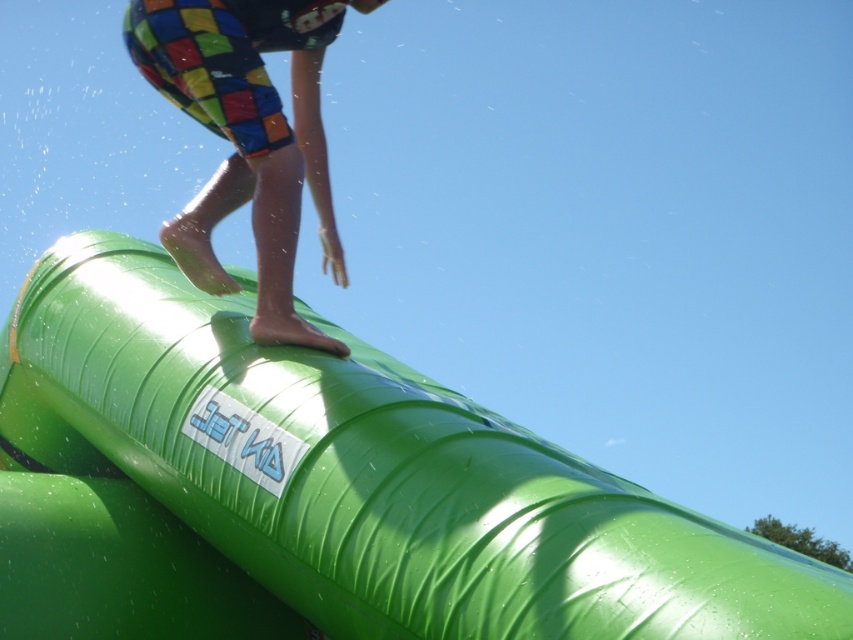
Question: Which of the following is the closest to the observer?

Choices:
 (A) green rubber slide at upper center
 (B) multicolored shorts at upper center

Answer: (A)

Question: Is green rubber slide at upper center closer to the viewer compared to multicolored shorts at upper center?

Choices:
 (A) yes
 (B) no

Answer: (A)

Question: Can you confirm if green rubber slide at upper center is positioned to the left of multicolored shorts at upper center?

Choices:
 (A) yes
 (B) no

Answer: (B)

Question: Does green rubber slide at upper center have a lesser width compared to multicolored shorts at upper center?

Choices:
 (A) yes
 (B) no

Answer: (B)